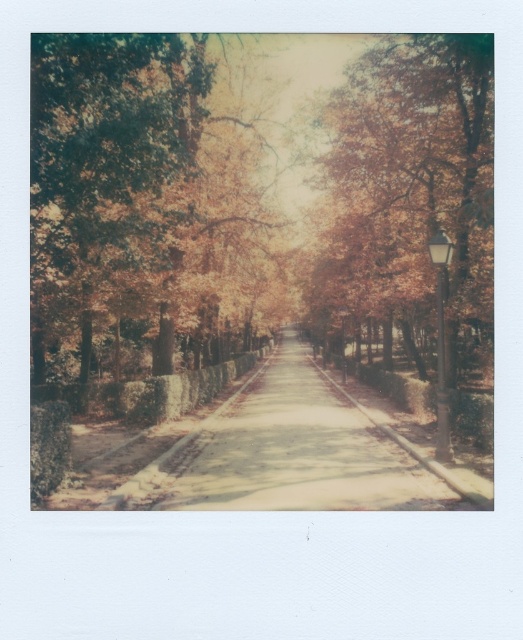
From the picture: You are standing at the point marked by the coordinates point (138, 196) in the image. What object is located exactly at that point?

The green textured tree at left is located exactly at point (138, 196).